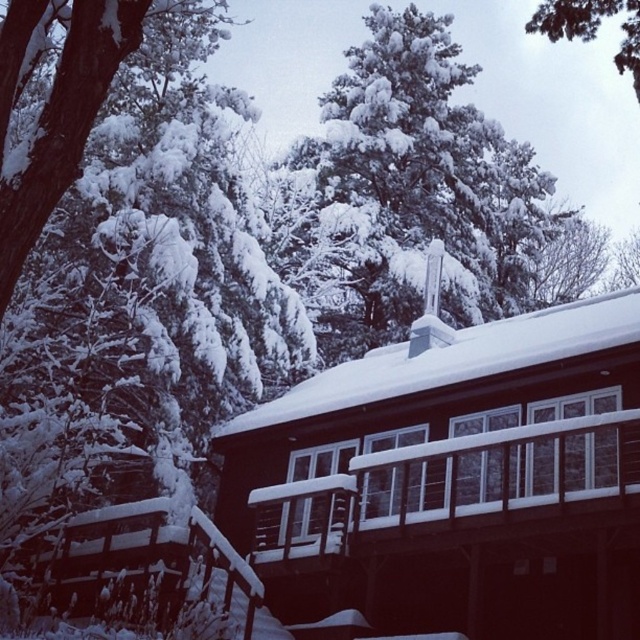
You are standing in front of the wooden house and want to determine the relative positions of two points marked in the image. Which point, point 1 at coordinates (378, 436) or point 2 at coordinates (400, 29), is closer to you?

Point 1 at coordinates (378, 436) is closer to the viewer than point 2 at coordinates (400, 29).